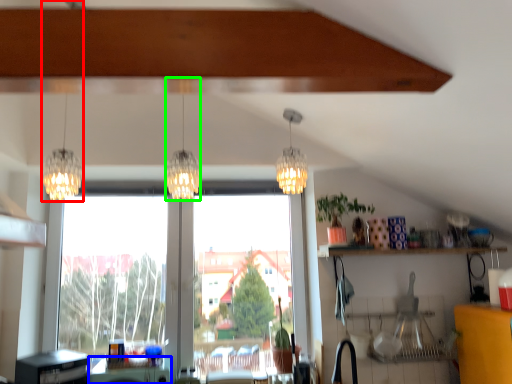
Question: Estimate the real-world distances between objects in this image. Which object is closer to lamp (highlighted by a red box), table (highlighted by a blue box) or lamp (highlighted by a green box)?

Choices:
 (A) table
 (B) lamp

Answer: (B)